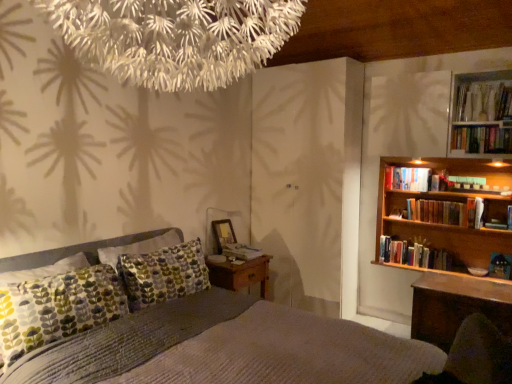
Question: Considering the relative sizes of hardcover books at upper right, which is counted as the 2th book, starting from the right, and hardcover book at upper right, which ranks as the fourth book in bottom-to-top order, in the image provided, is hardcover books at upper right, which is counted as the 2th book, starting from the right, smaller than hardcover book at upper right, which ranks as the fourth book in bottom-to-top order,?

Choices:
 (A) no
 (B) yes

Answer: (B)

Question: Can you confirm if hardcover books at upper right, the 5th book when ordered from bottom to top, is thinner than hardcover book at upper right, the fifth book from the right?

Choices:
 (A) no
 (B) yes

Answer: (B)

Question: Does hardcover books at upper right, arranged as the second book when viewed from the top, have a larger size compared to hardcover book at upper right, the third book from the top?

Choices:
 (A) yes
 (B) no

Answer: (B)

Question: Would you say hardcover book at upper right, the third book from the top, is part of hardcover books at upper right, the fifth book positioned from the left,'s contents?

Choices:
 (A) no
 (B) yes

Answer: (A)

Question: Is hardcover book at upper right, the fifth book from the right, at the back of hardcover books at upper right, arranged as the second book when viewed from the top?

Choices:
 (A) no
 (B) yes

Answer: (A)

Question: From the image's perspective, is hardcover books at upper right, arranged as the second book when viewed from the top, on hardcover book at upper right, which is the second book in left-to-right order?

Choices:
 (A) yes
 (B) no

Answer: (A)

Question: From a real-world perspective, is wooden picture frame at center under hardcover books at upper right, the fifth book positioned from the left?

Choices:
 (A) yes
 (B) no

Answer: (A)

Question: Is wooden picture frame at center not inside hardcover books at upper right, arranged as the second book when viewed from the top?

Choices:
 (A) yes
 (B) no

Answer: (A)

Question: Is wooden picture frame at center next to hardcover books at upper right, the fifth book positioned from the left?

Choices:
 (A) no
 (B) yes

Answer: (A)

Question: Is hardcover books at upper right, which is counted as the 2th book, starting from the right, inside wooden picture frame at center?

Choices:
 (A) no
 (B) yes

Answer: (A)

Question: Is wooden picture frame at center thinner than hardcover books at upper right, which is counted as the 2th book, starting from the right?

Choices:
 (A) yes
 (B) no

Answer: (B)

Question: From a real-world perspective, is wooden picture frame at center positioned over hardcover books at upper right, the fifth book positioned from the left, based on gravity?

Choices:
 (A) yes
 (B) no

Answer: (B)

Question: Is hardcover books at upper right, marked as the 6th book in a left-to-right arrangement, far from hardcover books at upper right, the fifth book positioned from the left?

Choices:
 (A) yes
 (B) no

Answer: (B)